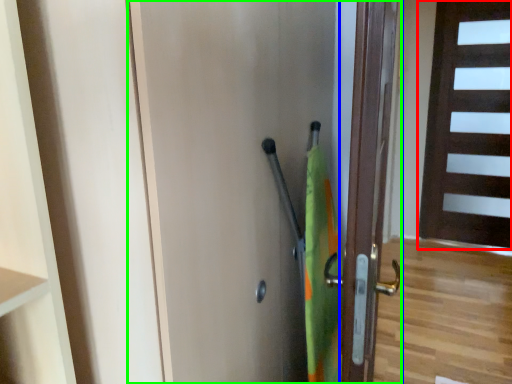
Question: Which object is the farthest from door (highlighted by a red box)? Choose among these: door (highlighted by a blue box) or door (highlighted by a green box).

Choices:
 (A) door
 (B) door

Answer: (B)